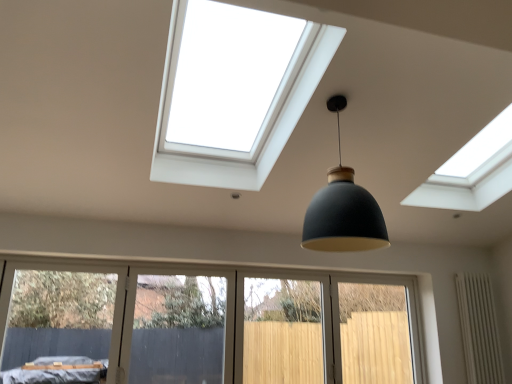
Question: From their relative heights in the image, would you say white textured radiator at lower right is taller or shorter than light wood screen door at lower center, which appears as the 2th screen door when viewed from the left?

Choices:
 (A) short
 (B) tall

Answer: (B)

Question: Considering the relative positions of white textured radiator at lower right and light wood screen door at lower center, which is the 1th screen door in right-to-left order, in the image provided, is white textured radiator at lower right to the left or to the right of light wood screen door at lower center, which is the 1th screen door in right-to-left order,?

Choices:
 (A) right
 (B) left

Answer: (A)

Question: Which object is the closest to the matte black pendant light at center?

Choices:
 (A) white textured radiator at lower right
 (B) light wood screen door at lower center, which is the 1th screen door in right-to-left order
 (C) transparent plastic screen door at lower center, which ranks as the first screen door in left-to-right order

Answer: (B)

Question: Considering the real-world distances, which object is closest to the light wood screen door at lower center, which is the 1th screen door in right-to-left order?

Choices:
 (A) white textured radiator at lower right
 (B) matte black pendant light at center
 (C) transparent plastic screen door at lower center, which ranks as the 2th screen door in right-to-left order

Answer: (A)